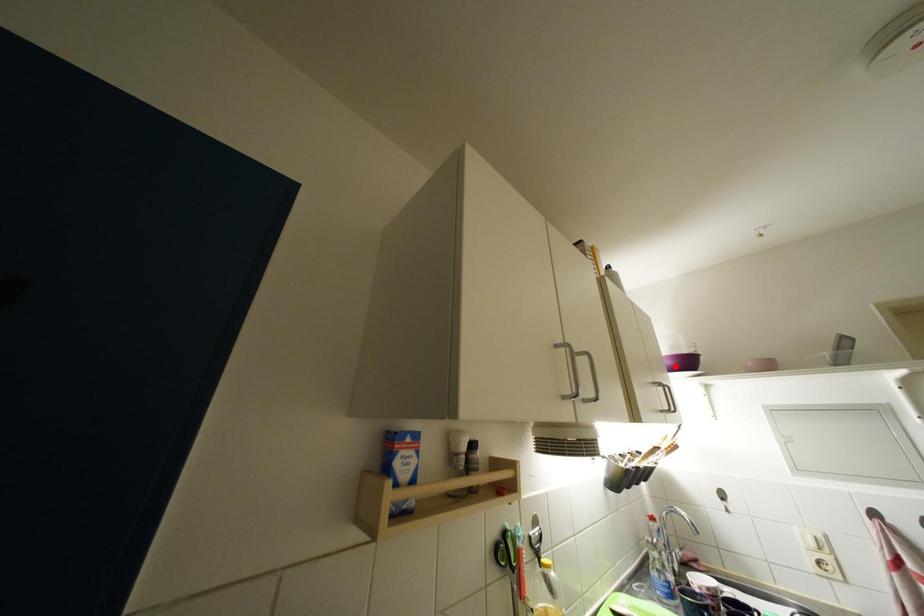
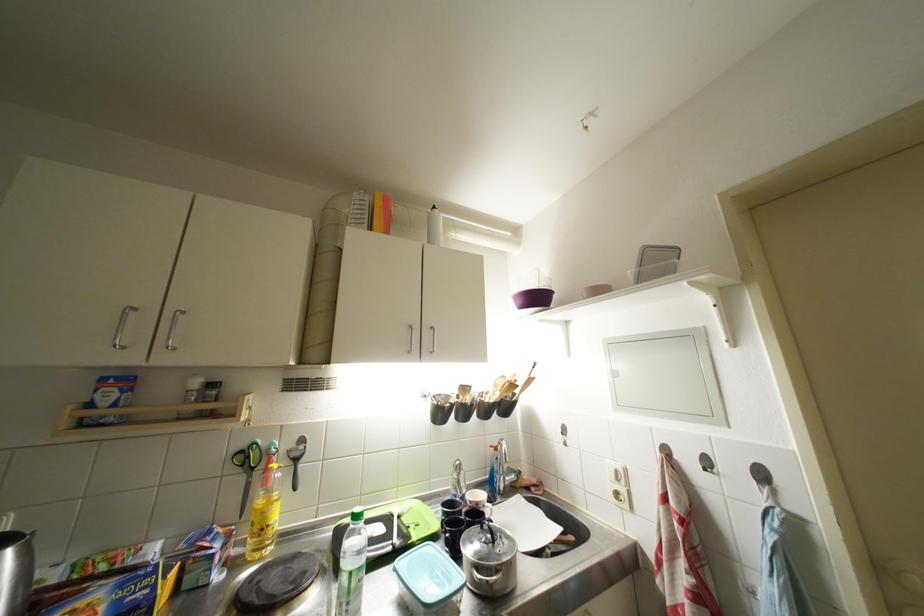
The point at the highlighted location is marked in the first image. Where is the corresponding point in the second image?

(527, 306)